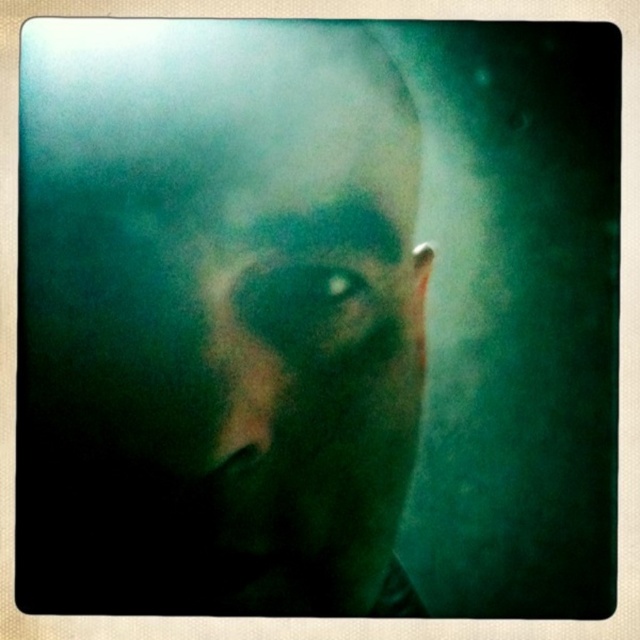
Question: Which object appears farthest from the camera in this image?

Choices:
 (A) smokey green eye at center
 (B) matte green face at center

Answer: (A)

Question: Is matte green face at center thinner than smokey green eye at center?

Choices:
 (A) yes
 (B) no

Answer: (B)

Question: Does matte green face at center appear over smokey green eye at center?

Choices:
 (A) no
 (B) yes

Answer: (B)

Question: Can you confirm if matte green face at center is positioned to the right of smokey green eye at center?

Choices:
 (A) no
 (B) yes

Answer: (A)

Question: Which point is farther to the camera?

Choices:
 (A) (330, 323)
 (B) (330, 433)

Answer: (A)